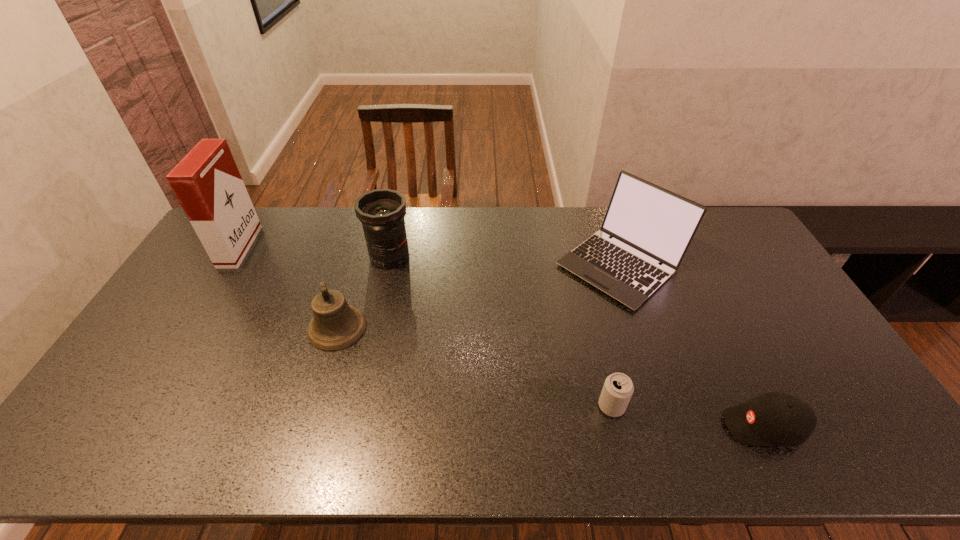
Where is `object located in the near edge section of the desktop`? The image size is (960, 540). object located in the near edge section of the desktop is located at coordinates (776, 418).

Identify the location of object at the left edge. The image size is (960, 540). (207, 183).

At what (x,y) coordinates should I click in order to perform the action: click on object that is positioned at the far left corner. Please return your answer as a coordinate pair (x, y). Image resolution: width=960 pixels, height=540 pixels. Looking at the image, I should click on [207, 183].

This screenshot has height=540, width=960. I want to click on vacant space at the far edge of the desktop, so click(490, 231).

The height and width of the screenshot is (540, 960). In the image, there is a desktop. Find the location of `free space at the near edge`. free space at the near edge is located at coordinates (224, 460).

At what (x,y) coordinates should I click in order to perform the action: click on vacant area at the left edge. Please return your answer as a coordinate pair (x, y). Looking at the image, I should click on (163, 320).

What are the coordinates of `free location at the right edge of the desktop` in the screenshot? It's located at (765, 284).

This screenshot has height=540, width=960. I want to click on free space at the far right corner, so click(732, 214).

Image resolution: width=960 pixels, height=540 pixels. Find the location of `free space between the laptop_computer and the fourth tallest object`. free space between the laptop_computer and the fourth tallest object is located at coordinates (478, 297).

The image size is (960, 540). What are the coordinates of `unoccupied position between the laptop_computer and the cigarette_case` in the screenshot? It's located at (430, 256).